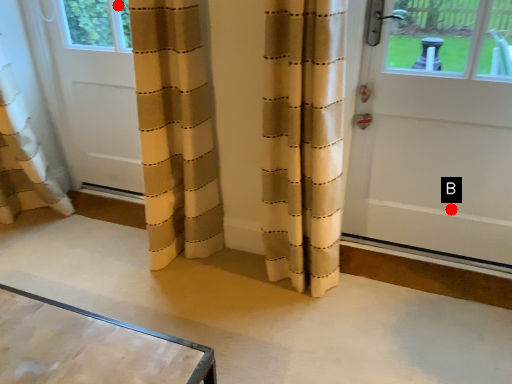
Question: Two points are circled on the image, labeled by A and B beside each circle. Among these points, which one is nearest to the camera?

Choices:
 (A) A is closer
 (B) B is closer

Answer: (B)